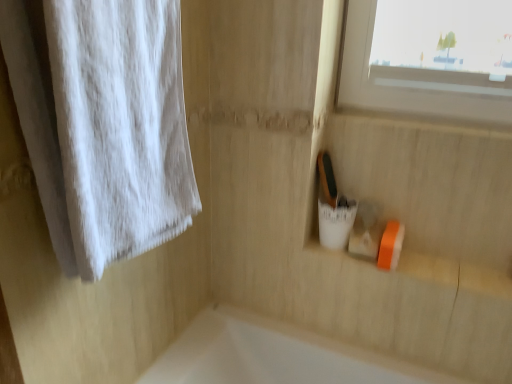
You are a GUI agent. You are given a task and a screenshot of the screen. Output one action in this format:
    pyautogui.click(x=<x>, y=<y>)
    Task: Click on the orange rubber at lower right
    Image resolution: width=512 pixels, height=384 pixels.
    Given the screenshot: What is the action you would take?
    pyautogui.click(x=457, y=274)

Describe the element at coordinates (457, 274) in the screenshot. This screenshot has height=384, width=512. I see `orange rubber at lower right` at that location.

The image size is (512, 384). Describe the element at coordinates (120, 126) in the screenshot. I see `white cotton towel at left` at that location.

Locate an element on the screen. The width and height of the screenshot is (512, 384). white cotton towel at left is located at coordinates (120, 126).

The height and width of the screenshot is (384, 512). Find the location of `orange rubber at lower right`. orange rubber at lower right is located at coordinates (457, 274).

Which is more to the left, white cotton towel at left or orange rubber at lower right?

From the viewer's perspective, white cotton towel at left appears more on the left side.

In the image, is white cotton towel at left positioned in front of or behind orange rubber at lower right?

white cotton towel at left is positioned closer to the viewer than orange rubber at lower right.

Which is in front, point (170, 223) or point (417, 268)?

The point (170, 223) is in front.

From the image's perspective, does white cotton towel at left appear higher than orange rubber at lower right?

Indeed, from the image's perspective, white cotton towel at left is shown above orange rubber at lower right.

From a real-world perspective, is white cotton towel at left positioned over orange rubber at lower right based on gravity?

Yes, from a real-world perspective, white cotton towel at left is above orange rubber at lower right.

Considering the sizes of white cotton towel at left and orange rubber at lower right in the image, is white cotton towel at left wider or thinner than orange rubber at lower right?

white cotton towel at left is wider than orange rubber at lower right.

Between white cotton towel at left and orange rubber at lower right, which one has less height?

orange rubber at lower right is shorter.

Between white cotton towel at left and orange rubber at lower right, which one has larger size?

Bigger between the two is white cotton towel at left.

Based on the photo, would you say white cotton towel at left is inside or outside orange rubber at lower right?

white cotton towel at left is spatially situated outside orange rubber at lower right.

Is white cotton towel at left positioned far away from orange rubber at lower right?

white cotton towel at left is actually quite close to orange rubber at lower right.

Based on the photo, is white cotton towel at left facing away from orange rubber at lower right?

white cotton towel at left does not have its back to orange rubber at lower right.

What's the angular difference between white cotton towel at left and orange rubber at lower right's facing directions?

The angular difference between white cotton towel at left and orange rubber at lower right is 91.7 degrees.

Locate an element on the screen. window sill that is on the right side of white cotton towel at left is located at coordinates (457, 274).

Between orange rubber at lower right and white cotton towel at left, which one appears on the left side from the viewer's perspective?

Result: From the viewer's perspective, white cotton towel at left appears more on the left side.

Considering their positions, is orange rubber at lower right located in front of or behind white cotton towel at left?

orange rubber at lower right is positioned farther from the viewer than white cotton towel at left.

Is point (423, 267) more distant than point (97, 253)?

Yes, it is behind point (97, 253).

From the picture: From the image's perspective, does orange rubber at lower right appear lower than white cotton towel at left?

Indeed, from the image's perspective, orange rubber at lower right is shown beneath white cotton towel at left.

From a real-world perspective, which is physically above, orange rubber at lower right or white cotton towel at left?

From a 3D spatial view, white cotton towel at left is above.

Between orange rubber at lower right and white cotton towel at left, which one has smaller width?

orange rubber at lower right.

Considering the sizes of objects orange rubber at lower right and white cotton towel at left in the image provided, who is taller, orange rubber at lower right or white cotton towel at left?

white cotton towel at left is taller.

From the picture: Which of these two, orange rubber at lower right or white cotton towel at left, is bigger?

white cotton towel at left.

Is orange rubber at lower right not within white cotton towel at left?

Yes.

Can you see orange rubber at lower right touching white cotton towel at left?

No, orange rubber at lower right is not in contact with white cotton towel at left.

Is orange rubber at lower right turned away from white cotton towel at left?

orange rubber at lower right is not turned away from white cotton towel at left.

Image resolution: width=512 pixels, height=384 pixels. Find the location of `window sill beneath the white cotton towel at left (from a real-world perspective)`. window sill beneath the white cotton towel at left (from a real-world perspective) is located at coordinates (457, 274).

In the image, there is a white cotton towel at left. Identify the location of window sill below it (from the image's perspective). (457, 274).

I want to click on curtain above the orange rubber at lower right (from the image's perspective), so click(120, 126).